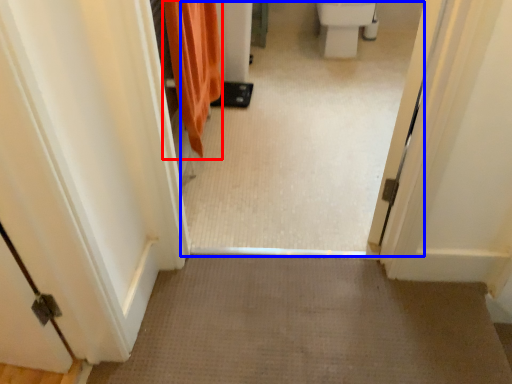
Question: Which of the following is the farthest to the observer, shower curtain (highlighted by a red box) or passage (highlighted by a blue box)?

Choices:
 (A) shower curtain
 (B) passage

Answer: (A)